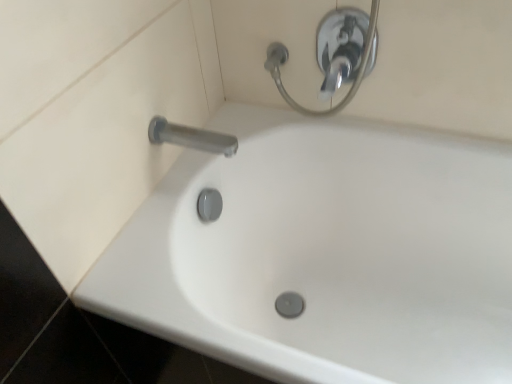
What do you see at coordinates (325, 254) in the screenshot?
I see `white glossy bathtub at center` at bounding box center [325, 254].

Where is `satin nickel faucet at upper left`? satin nickel faucet at upper left is located at coordinates pos(191,137).

Is satin nickel faucet at upper left positioned with its back to white glossy bathtub at center?

No, satin nickel faucet at upper left's orientation is not away from white glossy bathtub at center.

Which object is positioned more to the left, satin nickel faucet at upper left or white glossy bathtub at center?

From the viewer's perspective, satin nickel faucet at upper left appears more on the left side.

From a real-world perspective, is satin nickel faucet at upper left positioned above or below white glossy bathtub at center?

satin nickel faucet at upper left is above white glossy bathtub at center.

From the image's perspective, would you say white glossy bathtub at center is positioned over chrome metallic shower handle at upper center?

No, from the image's perspective, white glossy bathtub at center is not above chrome metallic shower handle at upper center.

How many degrees apart are the facing directions of white glossy bathtub at center and chrome metallic shower handle at upper center?

The angular difference between white glossy bathtub at center and chrome metallic shower handle at upper center is 0.621 degrees.

Can you confirm if white glossy bathtub at center is positioned to the left of chrome metallic shower handle at upper center?

No.

How distant is white glossy bathtub at center from chrome metallic shower handle at upper center?

white glossy bathtub at center and chrome metallic shower handle at upper center are 17.07 inches apart.

Considering their positions, is chrome metallic shower handle at upper center located in front of or behind white glossy bathtub at center?

chrome metallic shower handle at upper center is positioned farther from the viewer than white glossy bathtub at center.

Is chrome metallic shower handle at upper center shorter than white glossy bathtub at center?

Yes.

Considering the relative sizes of chrome metallic shower handle at upper center and white glossy bathtub at center in the image provided, is chrome metallic shower handle at upper center wider than white glossy bathtub at center?

No, chrome metallic shower handle at upper center is not wider than white glossy bathtub at center.

Considering the positions of objects chrome metallic shower handle at upper center and satin nickel faucet at upper left in the image provided, who is behind, chrome metallic shower handle at upper center or satin nickel faucet at upper left?

Positioned behind is chrome metallic shower handle at upper center.

Is chrome metallic shower handle at upper center wider than satin nickel faucet at upper left?

Incorrect, the width of chrome metallic shower handle at upper center does not surpass that of satin nickel faucet at upper left.

Is chrome metallic shower handle at upper center placed right next to satin nickel faucet at upper left?

chrome metallic shower handle at upper center and satin nickel faucet at upper left are not in contact.

Is satin nickel faucet at upper left surrounded by chrome metallic shower handle at upper center?

No, chrome metallic shower handle at upper center does not contain satin nickel faucet at upper left.

From a real-world perspective, is satin nickel faucet at upper left over chrome metallic shower handle at upper center?

Actually, satin nickel faucet at upper left is physically below chrome metallic shower handle at upper center in the real world.

Considering the relative sizes of satin nickel faucet at upper left and chrome metallic shower handle at upper center in the image provided, is satin nickel faucet at upper left thinner than chrome metallic shower handle at upper center?

No.

Is there a large distance between satin nickel faucet at upper left and chrome metallic shower handle at upper center?

That's not correct — satin nickel faucet at upper left is a little close to chrome metallic shower handle at upper center.

What's the angular difference between satin nickel faucet at upper left and chrome metallic shower handle at upper center's facing directions?

The facing directions of satin nickel faucet at upper left and chrome metallic shower handle at upper center are 88.7 degrees apart.

Considering the relative sizes of white glossy bathtub at center and satin nickel faucet at upper left in the image provided, is white glossy bathtub at center thinner than satin nickel faucet at upper left?

Incorrect, the width of white glossy bathtub at center is not less than that of satin nickel faucet at upper left.

Looking at this image, from a real-world perspective, is white glossy bathtub at center under satin nickel faucet at upper left?

Yes, from a real-world perspective, white glossy bathtub at center is under satin nickel faucet at upper left.

Which of these two, white glossy bathtub at center or satin nickel faucet at upper left, stands shorter?

With less height is satin nickel faucet at upper left.

Identify the location of tap lying behind the white glossy bathtub at center. (191, 137).

This screenshot has width=512, height=384. Find the location of `shower above the white glossy bathtub at center (from the image's perspective)`. shower above the white glossy bathtub at center (from the image's perspective) is located at coordinates (341, 47).

Looking at the image, which one is located closer to white glossy bathtub at center, chrome metallic shower handle at upper center or satin nickel faucet at upper left?

Among the two, chrome metallic shower handle at upper center is located nearer to white glossy bathtub at center.

Estimate the real-world distances between objects in this image. Which object is closer to white glossy bathtub at center, satin nickel faucet at upper left or chrome metallic shower handle at upper center?

Among the two, chrome metallic shower handle at upper center is located nearer to white glossy bathtub at center.

Considering their positions, is chrome metallic shower handle at upper center positioned closer to satin nickel faucet at upper left than white glossy bathtub at center?

The object closer to satin nickel faucet at upper left is chrome metallic shower handle at upper center.

Based on their spatial positions, is satin nickel faucet at upper left or white glossy bathtub at center further from chrome metallic shower handle at upper center?

white glossy bathtub at center lies further to chrome metallic shower handle at upper center than the other object.

Considering their positions, is white glossy bathtub at center positioned closer to chrome metallic shower handle at upper center than satin nickel faucet at upper left?

satin nickel faucet at upper left.

When comparing their distances from satin nickel faucet at upper left, does white glossy bathtub at center or chrome metallic shower handle at upper center seem closer?

The object closer to satin nickel faucet at upper left is chrome metallic shower handle at upper center.

You are a GUI agent. You are given a task and a screenshot of the screen. Output one action in this format:
    pyautogui.click(x=<x>, y=<y>)
    Task: Click on the tap between chrome metallic shower handle at upper center and white glossy bathtub at center in the vertical direction
    The image size is (512, 384).
    Given the screenshot: What is the action you would take?
    pyautogui.click(x=191, y=137)